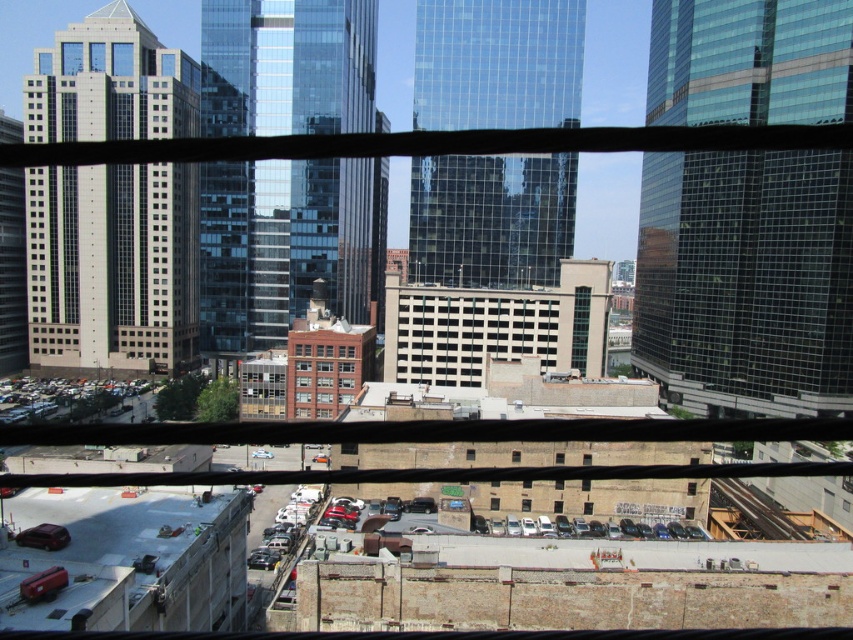
Does point (427, 321) come in front of point (566, 525)?

No.

Identify the location of white concrete building at center. (465, 332).

Where is `white concrete building at center`? This screenshot has height=640, width=853. white concrete building at center is located at coordinates (465, 332).

Does metallic silver car at lower center have a larger size compared to shiny metallic car at lower center?

Yes, metallic silver car at lower center is bigger than shiny metallic car at lower center.

Is the position of metallic silver car at lower center more distant than that of shiny metallic car at lower center?

Yes, metallic silver car at lower center is behind shiny metallic car at lower center.

You are a GUI agent. You are given a task and a screenshot of the screen. Output one action in this format:
    pyautogui.click(x=<x>, y=<y>)
    Task: Click on the metallic silver car at lower center
    
    Given the screenshot: What is the action you would take?
    pyautogui.click(x=662, y=531)

Find the location of a particular element. The image size is (853, 640). metallic silver car at lower center is located at coordinates (662, 531).

This screenshot has height=640, width=853. Find the location of `shiny silver car at lower center`. shiny silver car at lower center is located at coordinates (303, 502).

Image resolution: width=853 pixels, height=640 pixels. What are the coordinates of `shiny silver car at lower center` in the screenshot? It's located at (303, 502).